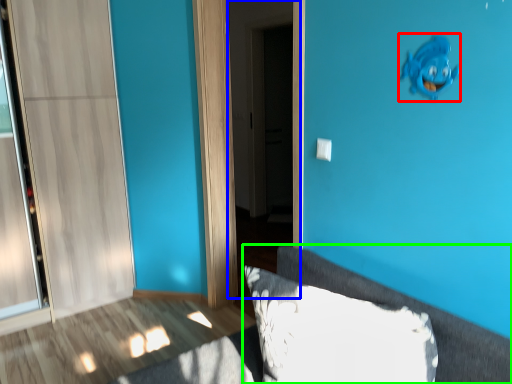
Question: Considering the real-world distances, which object is closest to animal (highlighted by a red box)? screen door (highlighted by a blue box) or furniture (highlighted by a green box).

Choices:
 (A) screen door
 (B) furniture

Answer: (B)